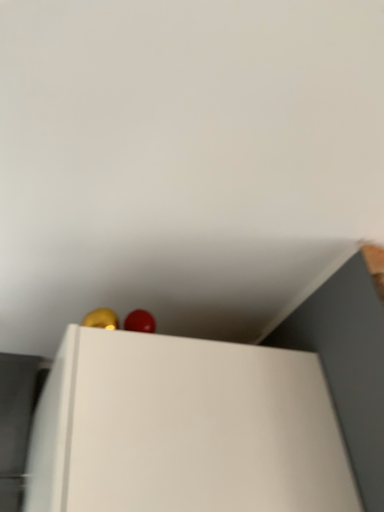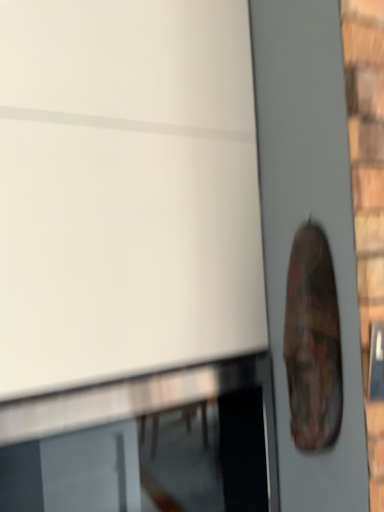
Question: Which way did the camera rotate in the video?

Choices:
 (A) rotated downward
 (B) rotated upward

Answer: (A)